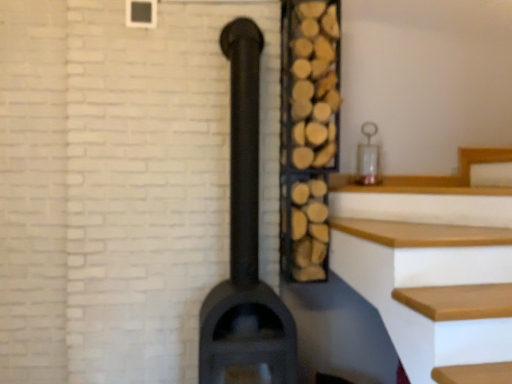
I want to click on black matte fireplace at center, so click(x=245, y=246).

The width and height of the screenshot is (512, 384). Describe the element at coordinates (245, 246) in the screenshot. I see `black matte fireplace at center` at that location.

Where is `black matte fireplace at center`? The width and height of the screenshot is (512, 384). black matte fireplace at center is located at coordinates (245, 246).